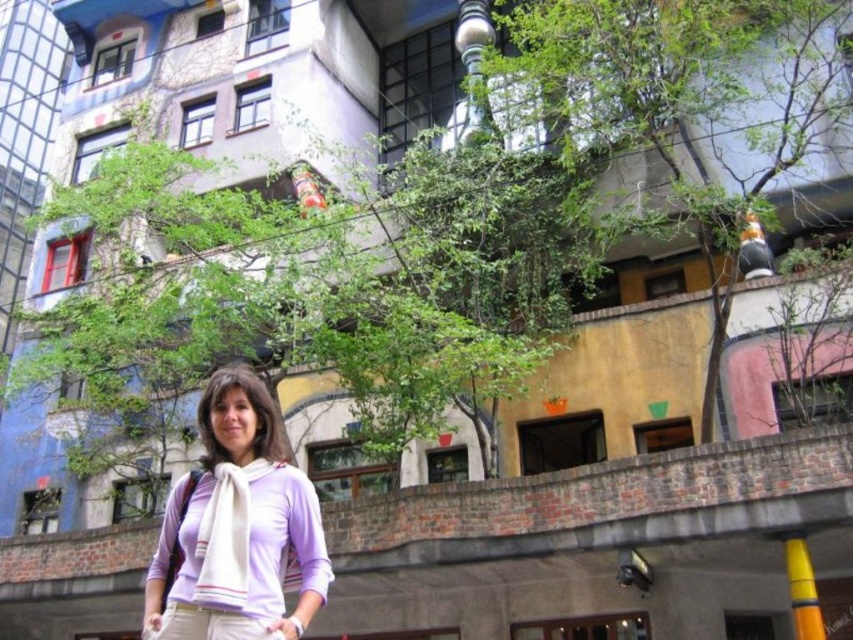
Can you confirm if green leafy tree at center is thinner than white soft scarf at center?

Incorrect, green leafy tree at center's width is not less than white soft scarf at center's.

Can you confirm if green leafy tree at center is bigger than white soft scarf at center?

Indeed, green leafy tree at center has a larger size compared to white soft scarf at center.

Between point (567, 292) and point (300, 618), which one is positioned in front?

Positioned in front is point (300, 618).

Where is `green leafy tree at center`? green leafy tree at center is located at coordinates pos(317,291).

Does green leafy tree at upper center have a larger size compared to white soft scarf at center?

Yes, green leafy tree at upper center is bigger than white soft scarf at center.

Is point (624, 102) behind point (215, 624)?

Yes, it is behind point (215, 624).

What are the coordinates of `green leafy tree at upper center` in the screenshot? It's located at (688, 104).

In the scene shown: Which is above, green leafy tree at center or green leafy tree at upper center?

green leafy tree at upper center

Is green leafy tree at center smaller than green leafy tree at upper center?

No, green leafy tree at center is not smaller than green leafy tree at upper center.

Which is behind, point (378, 275) or point (810, 100)?

The point (378, 275) is more distant.

Where is `green leafy tree at center`? The height and width of the screenshot is (640, 853). green leafy tree at center is located at coordinates (317, 291).